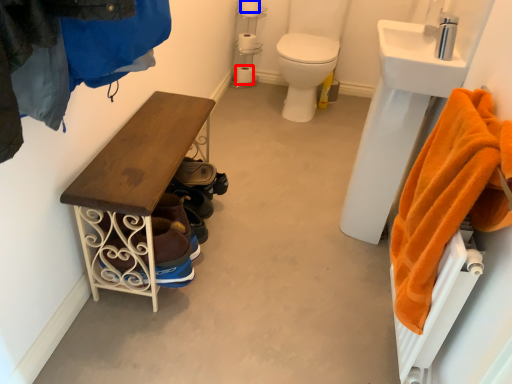
Question: Which object is further to the camera taking this photo, toilet paper (highlighted by a red box) or toilet paper (highlighted by a blue box)?

Choices:
 (A) toilet paper
 (B) toilet paper

Answer: (A)